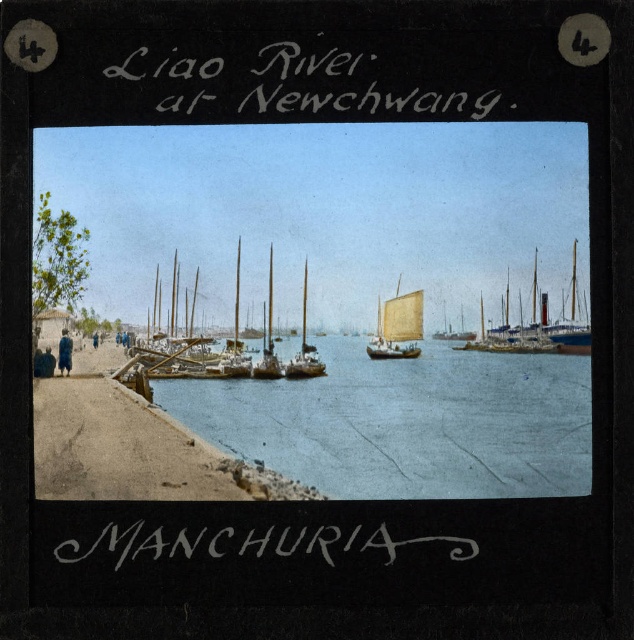
Where is `blue water at center`? The image size is (634, 640). blue water at center is located at coordinates (406, 422).

Can you confirm if blue water at center is thinner than wooden sailboat at center?

No, blue water at center is not thinner than wooden sailboat at center.

What do you see at coordinates (406, 422) in the screenshot?
I see `blue water at center` at bounding box center [406, 422].

The image size is (634, 640). In order to click on blue water at center in this screenshot , I will do `click(406, 422)`.

Does white sailcloth sailboat at center have a larger size compared to wooden sailboat at center?

Incorrect, white sailcloth sailboat at center is not larger than wooden sailboat at center.

From the picture: Can you confirm if white sailcloth sailboat at center is smaller than wooden sailboat at center?

Yes.

Who is more distant from viewer, (404, 349) or (314, 353)?

The point (314, 353) is behind.

Image resolution: width=634 pixels, height=640 pixels. Find the location of `white sailcloth sailboat at center`. white sailcloth sailboat at center is located at coordinates (398, 326).

Is blue water at center below blue wooden sailboat at center?

Yes.

Is blue water at center positioned before blue wooden sailboat at center?

Yes, blue water at center is in front of blue wooden sailboat at center.

Does point (321, 456) come closer to viewer compared to point (571, 259)?

That is False.

Locate an element on the screen. The image size is (634, 640). blue water at center is located at coordinates (406, 422).